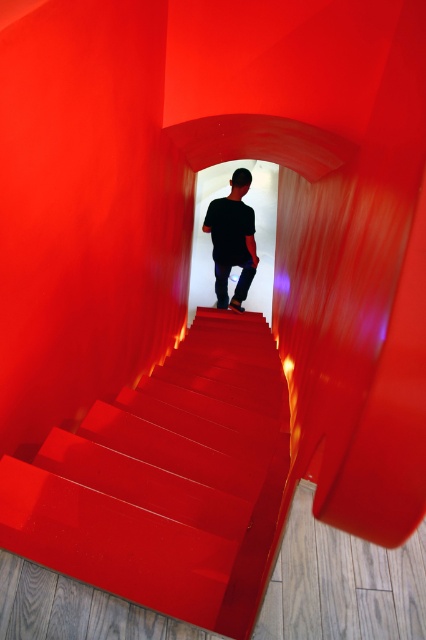
You are standing at the base of the staircase and want to reach the point marked as point [230,566] on the red staircase. If your maximum reach is 1.5 meters, can you touch that point without moving closer?

The point [230,566] is 1.40 meters away from the camera, so yes, you can touch it since it is within your 1.5 meters reach.

You are standing at the bottom of the staircase and want to take a photo of the glossy red stairs at center and the black matte shirt at center. Which object should you focus on first to ensure both are in focus?

You should focus on the glossy red stairs at center first because it is closer to you than the black matte shirt at center, so focusing on the closer object will help both be in focus.

You are an interior designer planning to place a decorative item on the glossy red stairs at center. Considering the size of the black matte shirt at center, which is present in the scene, do you think the stairs are wide enough to accommodate a large decorative piece?

The glossy red stairs at center are wider than the black matte shirt at center, so they should have enough space to accommodate a large decorative piece.